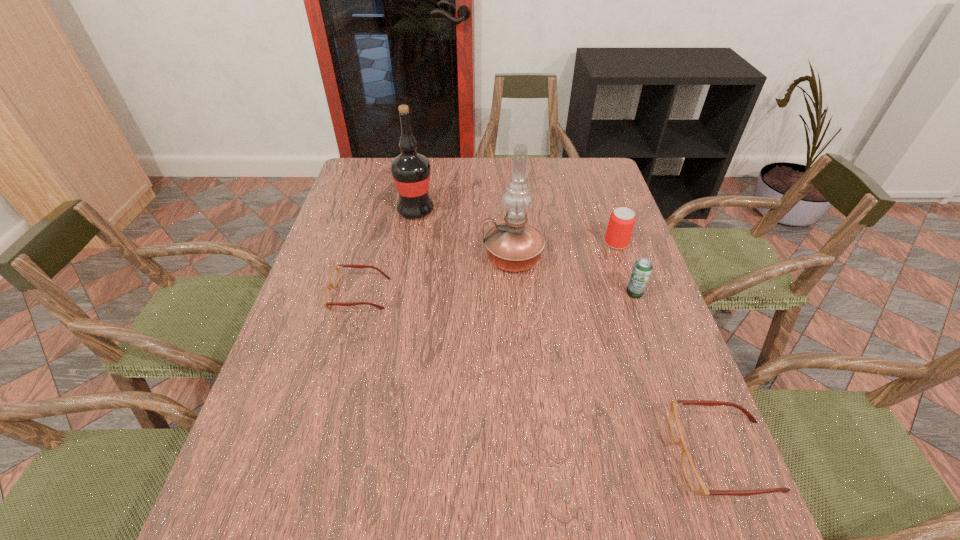
Identify which object is the closest to the second shortest object. Please provide its 2D coordinates. Your answer should be formatted as a tuple, i.e. [(x, y)], where the tuple contains the x and y coordinates of a point satisfying the conditions above.

[(642, 269)]

Select which object appears as the fourth closest to the shortest object. Please provide its 2D coordinates. Your answer should be formatted as a tuple, i.e. [(x, y)], where the tuple contains the x and y coordinates of a point satisfying the conditions above.

[(642, 269)]

Identify the location of free region that satisfies the following two spatial constraints: 1. on the front side of the nearer beer can; 2. on the right side of the farther beer can. (634, 293).

Identify the location of free space that satisfies the following two spatial constraints: 1. on the front side of the farther beer can; 2. on the right side of the wine bottle. The height and width of the screenshot is (540, 960). (410, 243).

This screenshot has width=960, height=540. Identify the location of free location that satisfies the following two spatial constraints: 1. on the front side of the oil lamp; 2. on the front-facing side of the shorter spectacles. (516, 294).